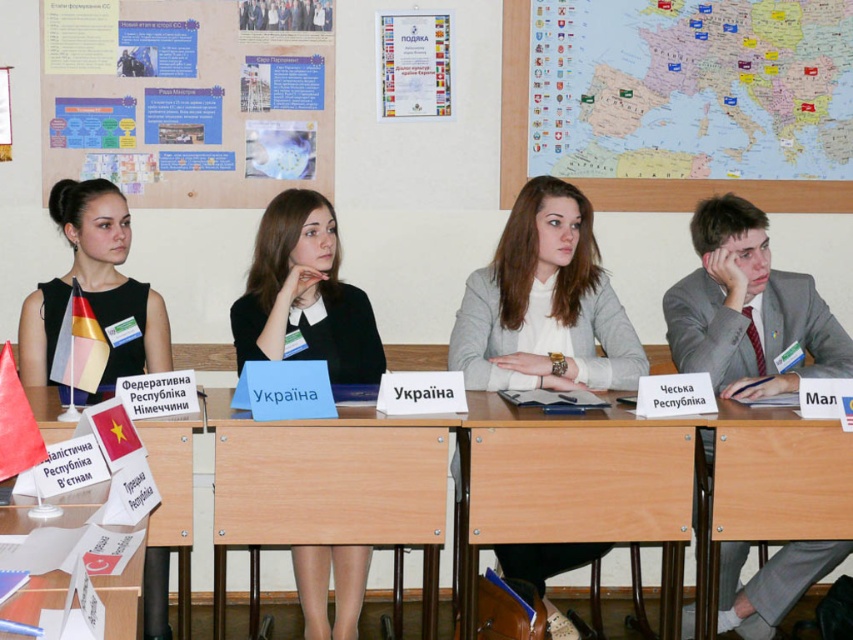
Question: Considering the relative positions of wooden table at center and gray suit at right in the image provided, where is wooden table at center located with respect to gray suit at right?

Choices:
 (A) left
 (B) right

Answer: (A)

Question: Is beech wood table at center bigger than gray suit at right?

Choices:
 (A) yes
 (B) no

Answer: (A)

Question: Can you confirm if paper map at upper center is positioned to the left of gray suit at right?

Choices:
 (A) no
 (B) yes

Answer: (B)

Question: Which point is closer to the camera?

Choices:
 (A) gray suit at right
 (B) beech wood table at center
 (C) black fabric dress at left

Answer: (B)

Question: Which object is positioned closest to the matte paper poster at upper left?

Choices:
 (A) gray suit at right
 (B) black fabric dress at left
 (C) wooden table at center

Answer: (B)

Question: Estimate the real-world distances between objects in this image. Which object is closer to the paper map at upper center?

Choices:
 (A) matte paper poster at upper left
 (B) light gray sweater at center
 (C) black matte dress at center
 (D) gray suit at right

Answer: (D)